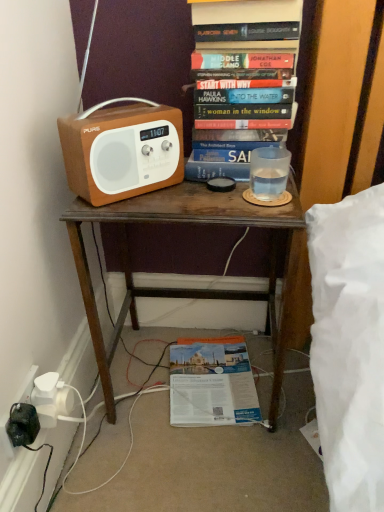
Measure the distance between point (244, 410) and camera.

Point (244, 410) and camera are 1.08 meters apart from each other.

This screenshot has width=384, height=512. What do you see at coordinates (190, 288) in the screenshot?
I see `brown wooden desk at center` at bounding box center [190, 288].

In order to click on matte paper magazine at lower center, placed as the 1th book when sorted from back to front in this screenshot , I will do `click(212, 383)`.

Which object is thinner, matte paper magazine at lower center, placed as the 1th book when sorted from bottom to top, or hardcover book at upper center, which is the first book from front to back?

With smaller width is hardcover book at upper center, which is the first book from front to back.

In the scene shown: From the image's perspective, which one is positioned lower, matte paper magazine at lower center, which is the second book from top to bottom, or hardcover book at upper center, which is the first book from front to back?

matte paper magazine at lower center, which is the second book from top to bottom, appears lower in the image.

Is matte paper magazine at lower center, placed as the 1th book when sorted from bottom to top, oriented away from hardcover book at upper center, the 2th book in the bottom-to-top sequence?

That's not correct — matte paper magazine at lower center, placed as the 1th book when sorted from bottom to top, is not looking away from hardcover book at upper center, the 2th book in the bottom-to-top sequence.

The image size is (384, 512). I want to click on book above the matte paper magazine at lower center, which is the second book from front to back (from the image's perspective), so click(x=242, y=82).

Is brown wooden desk at center surrounded by matte paper magazine at lower center, placed as the 1th book when sorted from back to front?

That's incorrect, brown wooden desk at center is not inside matte paper magazine at lower center, placed as the 1th book when sorted from back to front.

Is matte paper magazine at lower center, which is the second book from top to bottom, to the right of brown wooden desk at center from the viewer's perspective?

Correct, you'll find matte paper magazine at lower center, which is the second book from top to bottom, to the right of brown wooden desk at center.

Considering the positions of point (238, 365) and point (288, 261), is point (238, 365) closer or farther from the camera than point (288, 261)?

Clearly, point (238, 365) is more distant from the camera than point (288, 261).

From a real-world perspective, is matte paper magazine at lower center, which is the second book from front to back, located higher than brown wooden desk at center?

Actually, matte paper magazine at lower center, which is the second book from front to back, is physically below brown wooden desk at center in the real world.

Consider the image. Is matte brown radio at left turned away from matte paper magazine at lower center, placed as the 1th book when sorted from bottom to top?

No, matte brown radio at left is not facing the opposite direction of matte paper magazine at lower center, placed as the 1th book when sorted from bottom to top.

I want to click on the 2nd book behind the matte brown radio at left, so click(x=212, y=383).

How different are the orientations of matte brown radio at left and matte paper magazine at lower center, placed as the 1th book when sorted from bottom to top, in degrees?

The angle between the facing direction of matte brown radio at left and the facing direction of matte paper magazine at lower center, placed as the 1th book when sorted from bottom to top, is 34.6 degrees.

Is point (119, 175) more distant than point (202, 391)?

That is False.

Is matte brown radio at left further to camera compared to brown wooden desk at center?

No, matte brown radio at left is in front of brown wooden desk at center.

Between point (129, 176) and point (236, 223), which one is positioned in front?

The point (236, 223) is closer.

From the image's perspective, which is above, matte brown radio at left or brown wooden desk at center?

matte brown radio at left appears higher in the image.

Are hardcover book at upper center, placed as the second book when sorted from back to front, and matte paper magazine at lower center, which is the second book from front to back, located far from each other?

hardcover book at upper center, placed as the second book when sorted from back to front, is near matte paper magazine at lower center, which is the second book from front to back, not far away.

Could you tell me if hardcover book at upper center, placed as the second book when sorted from back to front, is turned towards matte paper magazine at lower center, which is the second book from front to back?

No, hardcover book at upper center, placed as the second book when sorted from back to front, is not turned towards matte paper magazine at lower center, which is the second book from front to back.

From the image's perspective, is hardcover book at upper center, which is the first book from front to back, under matte paper magazine at lower center, which is the second book from front to back?

No.

What's the angular difference between hardcover book at upper center, which is the first book from front to back, and matte paper magazine at lower center, which is the second book from front to back,'s facing directions?

They differ by 7.75 degrees in their facing directions.

Between matte brown radio at left and hardcover book at upper center, the 2th book in the bottom-to-top sequence, which one has less height?

With less height is matte brown radio at left.

Between matte brown radio at left and hardcover book at upper center, which ranks as the 1th book in top-to-bottom order, which one has larger width?

Wider between the two is hardcover book at upper center, which ranks as the 1th book in top-to-bottom order.

Considering the positions of points (111, 156) and (272, 144), is point (111, 156) closer to camera compared to point (272, 144)?

Yes, it is in front of point (272, 144).

From the image's perspective, which object appears higher, hardcover book at upper center, the 2th book in the bottom-to-top sequence, or brown wooden desk at center?

hardcover book at upper center, the 2th book in the bottom-to-top sequence.

From the picture: Relative to brown wooden desk at center, is hardcover book at upper center, which ranks as the 1th book in top-to-bottom order, in front or behind?

hardcover book at upper center, which ranks as the 1th book in top-to-bottom order, is behind brown wooden desk at center.

From a real-world perspective, which object stands above the other?

In real-world perspective, hardcover book at upper center, which ranks as the 1th book in top-to-bottom order, is above.

In the image, there is a hardcover book at upper center, placed as the second book when sorted from back to front. In order to click on book below it (from the image's perspective) in this screenshot , I will do `click(212, 383)`.

Identify the location of desk that appears on the left of matte paper magazine at lower center, which is the second book from front to back. (190, 288).

Based on their spatial positions, is matte brown radio at left or hardcover book at upper center, which ranks as the 1th book in top-to-bottom order, closer to brown wooden desk at center?

matte brown radio at left.

Considering their positions, is hardcover book at upper center, placed as the second book when sorted from back to front, positioned further to matte brown radio at left than brown wooden desk at center?

brown wooden desk at center lies further to matte brown radio at left than the other object.

Based on their spatial positions, is matte paper magazine at lower center, placed as the 1th book when sorted from back to front, or brown wooden desk at center closer to hardcover book at upper center, placed as the second book when sorted from back to front?

The object closer to hardcover book at upper center, placed as the second book when sorted from back to front, is brown wooden desk at center.

Based on their spatial positions, is hardcover book at upper center, placed as the second book when sorted from back to front, or matte brown radio at left closer to brown wooden desk at center?

matte brown radio at left lies closer to brown wooden desk at center than the other object.

Estimate the real-world distances between objects in this image. Which object is closer to matte brown radio at left, brown wooden desk at center or matte paper magazine at lower center, which is the second book from front to back?

brown wooden desk at center.

Looking at the image, which one is located further to hardcover book at upper center, which is the first book from front to back, matte brown radio at left or brown wooden desk at center?

brown wooden desk at center lies further to hardcover book at upper center, which is the first book from front to back, than the other object.

Considering their positions, is brown wooden desk at center positioned closer to matte paper magazine at lower center, placed as the 1th book when sorted from bottom to top, than hardcover book at upper center, which is the first book from front to back?

brown wooden desk at center is closer to matte paper magazine at lower center, placed as the 1th book when sorted from bottom to top.

From the image, which object appears to be nearer to brown wooden desk at center, matte paper magazine at lower center, which is the second book from front to back, or matte brown radio at left?

matte brown radio at left is positioned closer to the anchor brown wooden desk at center.

Where is `desk between matte brown radio at left and matte paper magazine at lower center, placed as the 1th book when sorted from bottom to top, in the up-down direction`? The image size is (384, 512). desk between matte brown radio at left and matte paper magazine at lower center, placed as the 1th book when sorted from bottom to top, in the up-down direction is located at coordinates (190, 288).

Image resolution: width=384 pixels, height=512 pixels. I want to click on cassette that lies between hardcover book at upper center, which ranks as the 1th book in top-to-bottom order, and matte paper magazine at lower center, placed as the 1th book when sorted from back to front, from top to bottom, so click(122, 151).

Locate an element on the screen. The image size is (384, 512). cassette between hardcover book at upper center, which is the first book from front to back, and brown wooden desk at center, in the vertical direction is located at coordinates (122, 151).

The width and height of the screenshot is (384, 512). I want to click on desk that lies between hardcover book at upper center, which ranks as the 1th book in top-to-bottom order, and matte paper magazine at lower center, which is the second book from front to back, from top to bottom, so click(x=190, y=288).